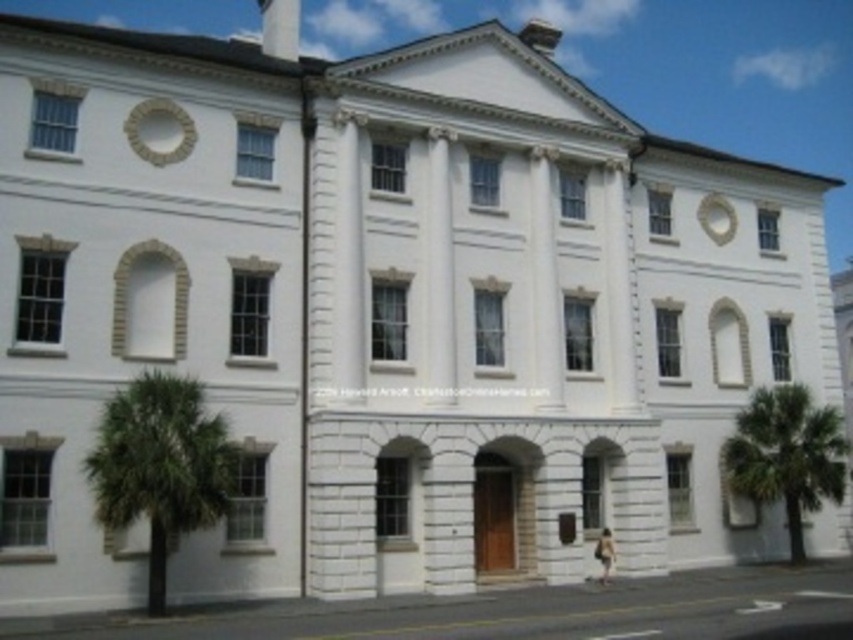
Is green leafy palm tree at lower left closer to the viewer compared to green leafy palm tree at right?

Yes, green leafy palm tree at lower left is closer to the viewer.

Who is more forward, (161, 435) or (807, 401)?

Point (161, 435)

The image size is (853, 640). In order to click on green leafy palm tree at lower left in this screenshot , I will do `click(161, 465)`.